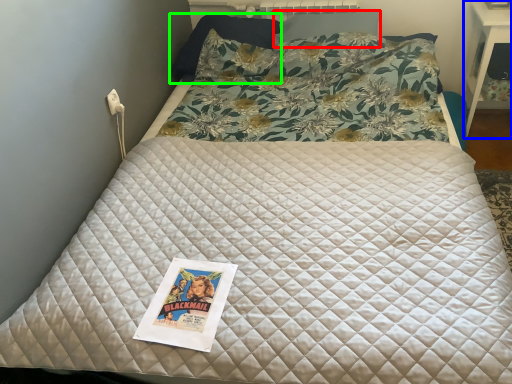
Question: Estimate the real-world distances between objects in this image. Which object is farther from pillow (highlighted by a red box), table (highlighted by a blue box) or pillow (highlighted by a green box)?

Choices:
 (A) table
 (B) pillow

Answer: (A)